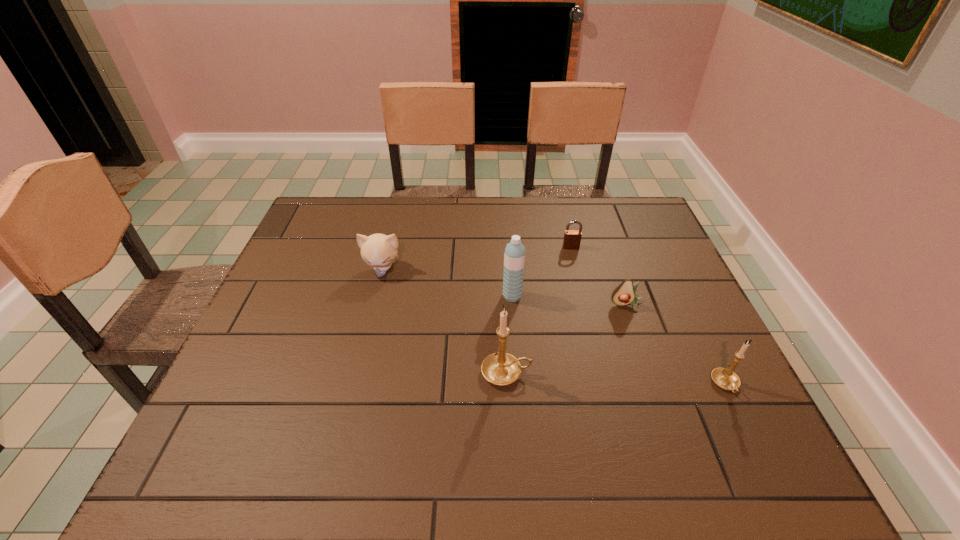
Observe the arrangement of all candle holders in the image. To keep them evenly spaced, where would you place another candle holder on the left? Please locate a free space. Please provide its 2D coordinates. Your answer should be formatted as a tuple, i.e. [(x, y)], where the tuple contains the x and y coordinates of a point satisfying the conditions above.

[(298, 361)]